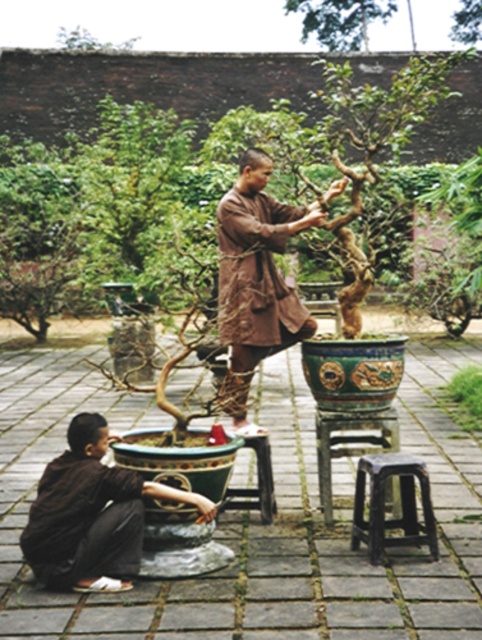
Is brown cotton robe at lower left shorter than wooden stool at center?

No.

Find the location of a particular element. The width and height of the screenshot is (482, 640). brown cotton robe at lower left is located at coordinates (83, 522).

Who is more forward, (89, 556) or (243, 506)?

Point (89, 556) is in front.

Where is `brown cotton robe at lower left`? brown cotton robe at lower left is located at coordinates (83, 522).

Does black plastic stool at lower center have a smaller size compared to black plastic stool at center?

Yes, black plastic stool at lower center is smaller than black plastic stool at center.

Is black plastic stool at lower center below black plastic stool at center?

Yes, black plastic stool at lower center is below black plastic stool at center.

The height and width of the screenshot is (640, 482). I want to click on black plastic stool at lower center, so click(384, 504).

This screenshot has height=640, width=482. In order to click on black plastic stool at center in this screenshot , I will do `click(349, 442)`.

What do you see at coordinates (349, 442) in the screenshot?
I see `black plastic stool at center` at bounding box center [349, 442].

The height and width of the screenshot is (640, 482). Describe the element at coordinates (349, 442) in the screenshot. I see `black plastic stool at center` at that location.

Image resolution: width=482 pixels, height=640 pixels. In order to click on black plastic stool at center in this screenshot , I will do `click(349, 442)`.